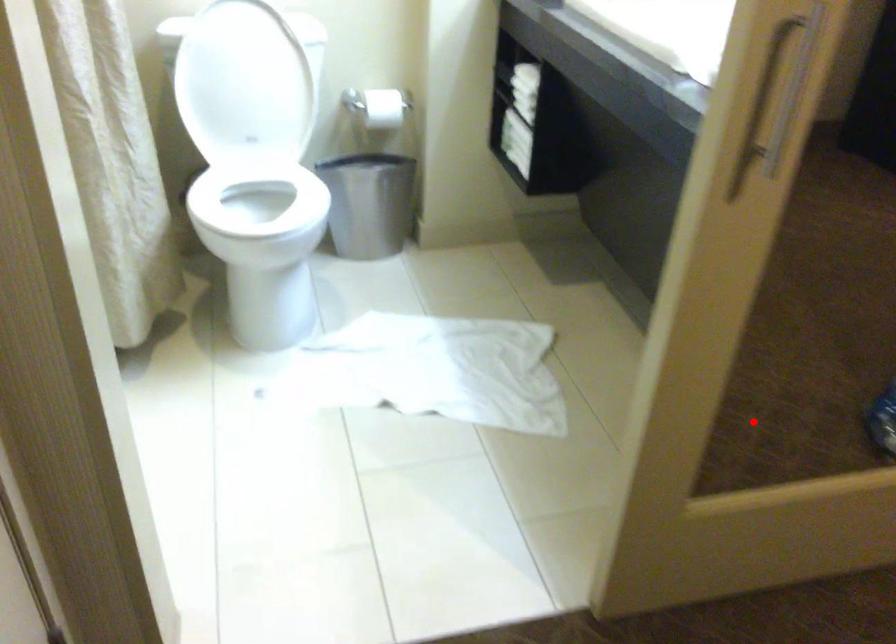
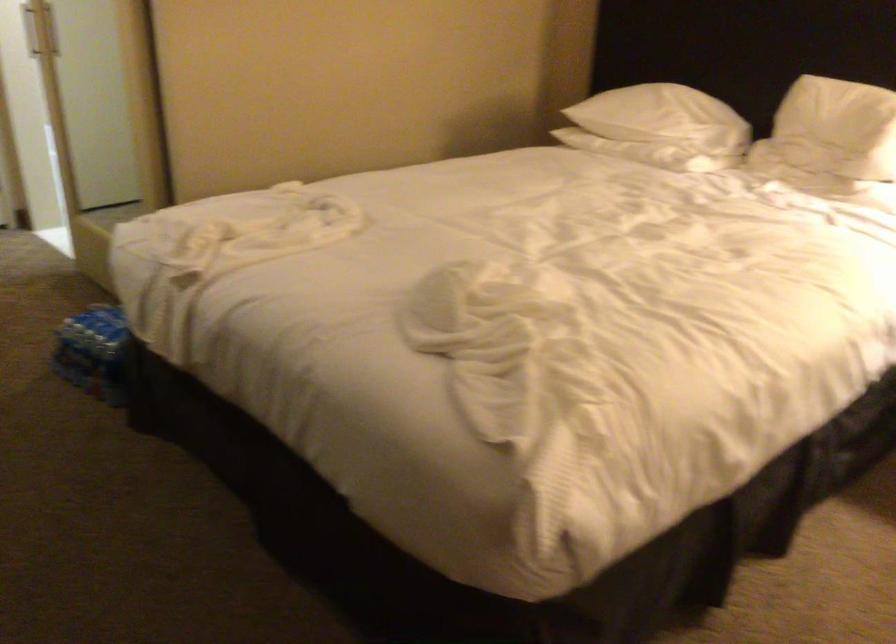
Question: I am providing you with two images of the same scene from different viewpoints. A red point is marked on the first image. At the location where the point appears in image 1, is it still visible in image 2?

Choices:
 (A) Yes
 (B) No

Answer: (B)